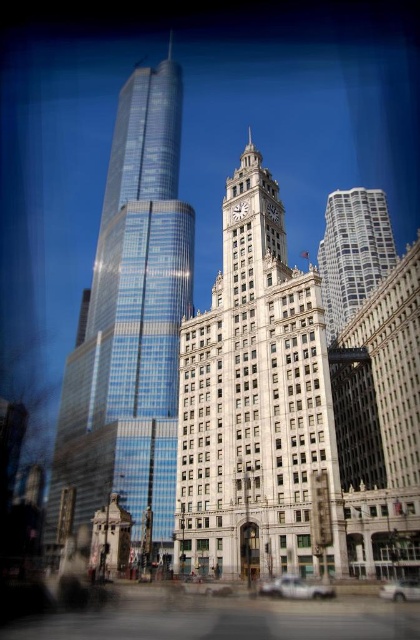
You are standing at the point with coordinates [130,324] in the urban scene. Which object are you closest to?

The point at [130,324] corresponds to the shiny glass skyscraper at left, so you are closest to the shiny glass skyscraper at left.

You are a drone operator tasked with flying a drone between the white stone clock tower at center and the white glass tower at center. The drone has a maximum flight distance of 30 meters. Based on the scene, can the drone safely complete the flight between these two structures?

The distance between the white stone clock tower at center and the white glass tower at center is 28.92 meters, which is within the drone operator maximum flight distance of 30 meters. The drone can safely complete the flight between these two structures.

You are a city planner assessing the urban landscape. You need to determine if the shiny glass skyscraper at left will block sunlight from reaching the silver metallic car at lower center. Based on their relative heights, can you predict if the skyscraper will cast a shadow over the car?

The shiny glass skyscraper at left is taller than the silver metallic car at lower center. Since the skyscraper is taller, it has the potential to cast a shadow over the car depending on the time of day and sun angle, but the description does not provide information about their exact positions or the sun direction. However, based solely on height, the skyscraper could block sunlight if positioned appropriately.